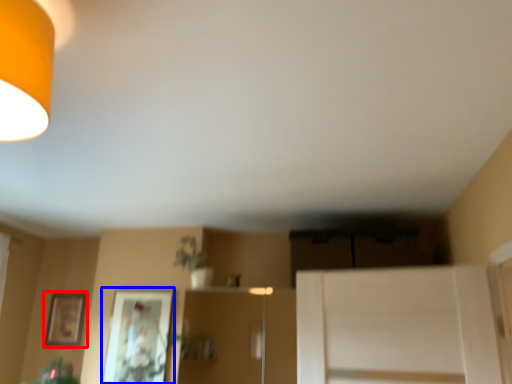
Question: Which object is further to the camera taking this photo, picture frame (highlighted by a red box) or picture frame (highlighted by a blue box)?

Choices:
 (A) picture frame
 (B) picture frame

Answer: (A)